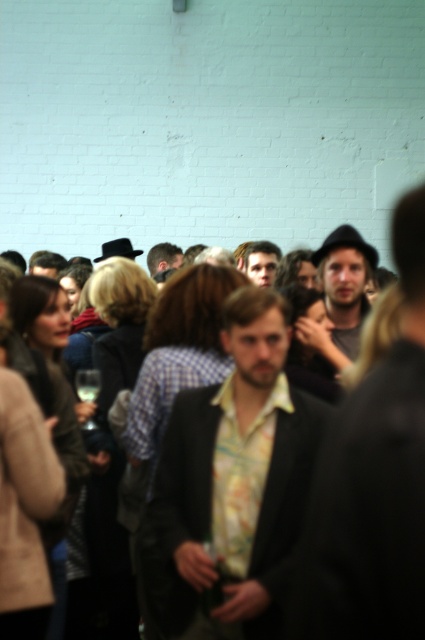
Question: Does floral-patterned shirt at center appear on the left side of shiny brown hair at center?

Choices:
 (A) yes
 (B) no

Answer: (B)

Question: Which point is farther to the camera?

Choices:
 (A) (328, 444)
 (B) (166, 522)

Answer: (B)

Question: Does floral-patterned shirt at center appear on the left side of shiny brown hair at center?

Choices:
 (A) no
 (B) yes

Answer: (A)

Question: Which point is farther to the camera?

Choices:
 (A) matte yellow shirt at center
 (B) shiny brown hair at center
 (C) floral-patterned shirt at center

Answer: (B)

Question: Estimate the real-world distances between objects in this image. Which object is farther from the floral print shirt at center?

Choices:
 (A) shiny brown hair at center
 (B) matte black hat at center

Answer: (A)

Question: Is floral print shirt at center smaller than floral-patterned shirt at center?

Choices:
 (A) yes
 (B) no

Answer: (B)